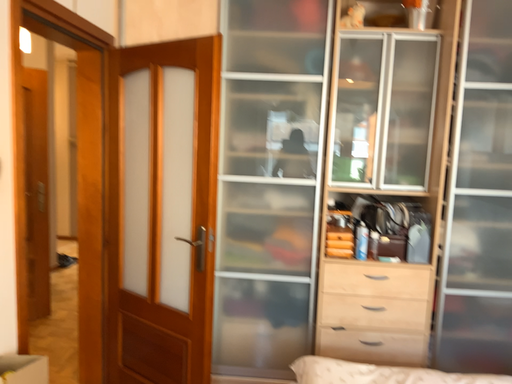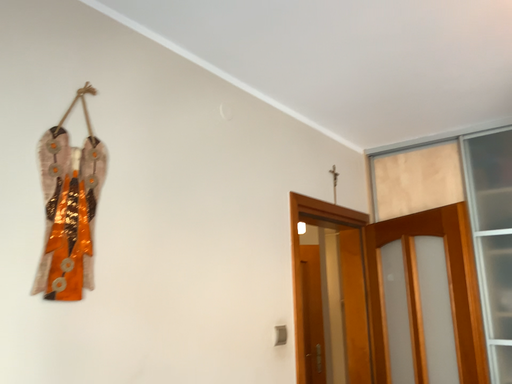
Question: Which way did the camera rotate in the video?

Choices:
 (A) rotated downward
 (B) rotated upward

Answer: (B)